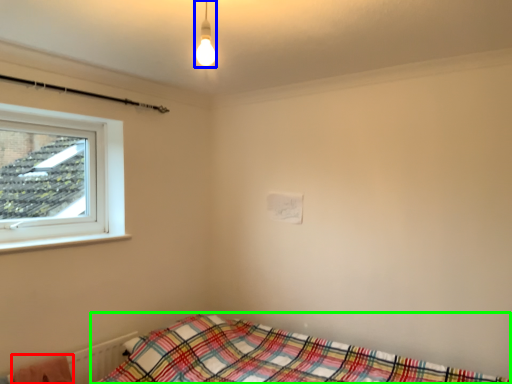
Question: Considering the real-world distances, which object is closest to blanket (highlighted by a red box)? light fixture (highlighted by a blue box) or bed (highlighted by a green box).

Choices:
 (A) light fixture
 (B) bed

Answer: (B)